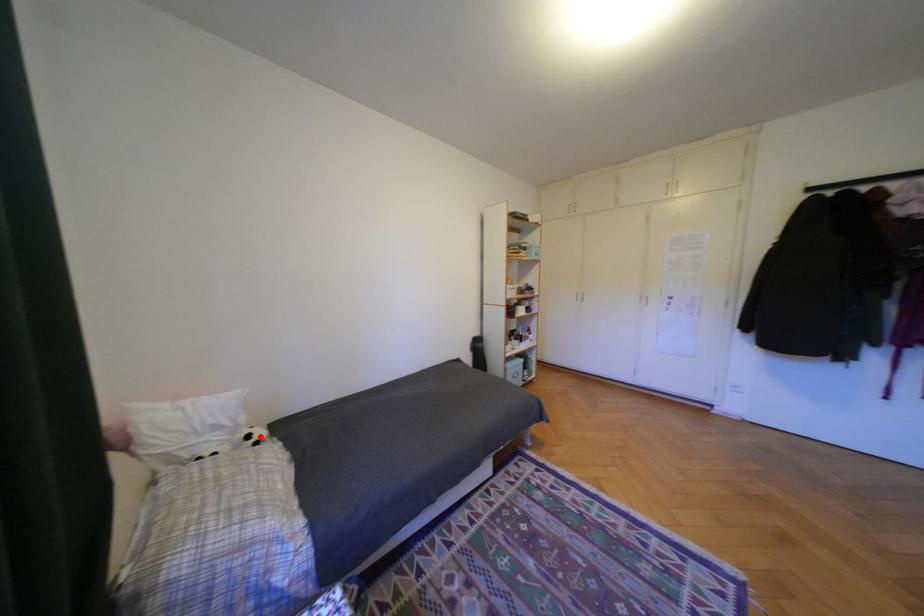
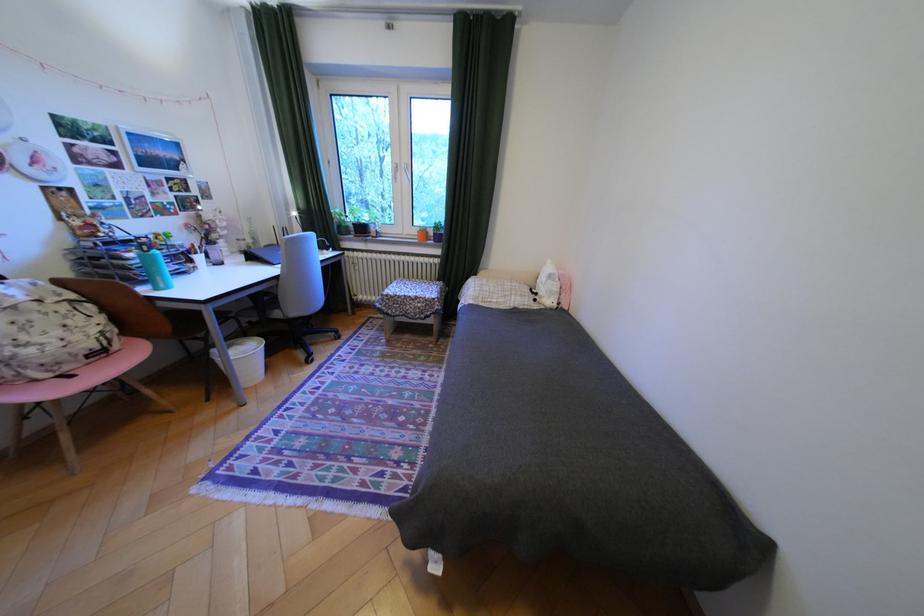
Where in the second image is the point corresponding to the highlighted location from the first image?

(548, 294)